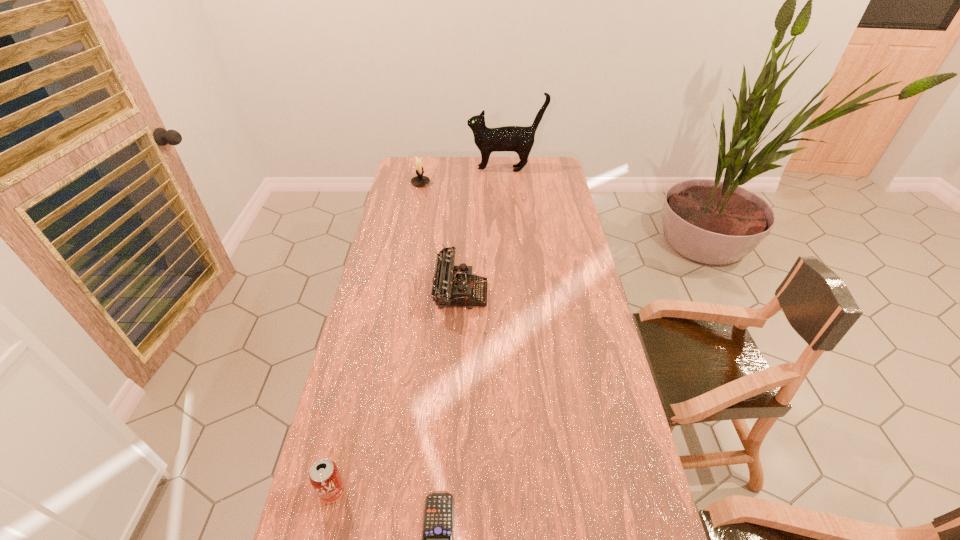
I want to click on free spot located on the keyboard of the third nearest object, so click(549, 293).

Find the location of a particular element. This screenshot has width=960, height=540. vacant space located on the right of the soda can is located at coordinates (411, 491).

This screenshot has height=540, width=960. What are the coordinates of `cat at the far edge` in the screenshot? It's located at (518, 139).

The height and width of the screenshot is (540, 960). Identify the location of candle holder situated at the far edge. (419, 180).

This screenshot has width=960, height=540. In order to click on candle holder that is at the left edge in this screenshot , I will do `click(419, 180)`.

The image size is (960, 540). What are the coordinates of `soda can located at the left edge` in the screenshot? It's located at (324, 476).

What are the coordinates of `object that is at the right edge` in the screenshot? It's located at (518, 139).

Where is `object at the far left corner`? object at the far left corner is located at coordinates (419, 180).

At what (x,y) coordinates should I click in order to perform the action: click on object that is positioned at the far right corner. Please return your answer as a coordinate pair (x, y). This screenshot has height=540, width=960. Looking at the image, I should click on (518, 139).

In the image, there is a desktop. Identify the location of vacant space at the far edge. (479, 178).